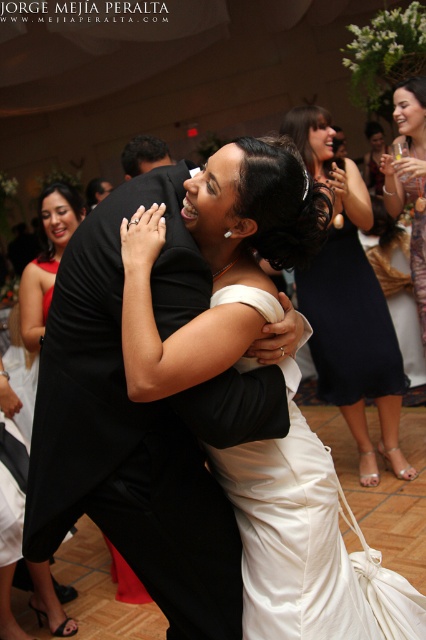
You are a photographer at the wedding reception and need to capture a photo that includes both the satin white dress at center and the matte black dress at left. Since you want both subjects to be in focus, which dress should you position closer to the camera to ensure depth of field?

The satin white dress at center is already closer to the viewer than the matte black dress at left, so positioning the satin white dress at center closer to the camera would help ensure both are in focus by adjusting the depth of field accordingly.

You are a photographer at the wedding reception. You need to capture a photo where both the matte black dress at left and the black satin suit at center are visible. Based on their positions, which one should you adjust your camera angle to focus on first to ensure both are in frame?

The matte black dress at left is below the black satin suit at center, so you should focus on the black satin suit at center first and then adjust downward to include the matte black dress at left in the frame.

You are a photographer at the wedding reception. You need to capture a photo that includes both the satin white dress at center and the matte black dress at left. The camera you are using has a maximum focus range of 4 feet. Can you frame both subjects within the camera focus range?

The distance between the satin white dress at center and the matte black dress at left is 4.40 feet, which exceeds the camera focus range of 4 feet. Therefore, you cannot frame both subjects within the camera focus range.